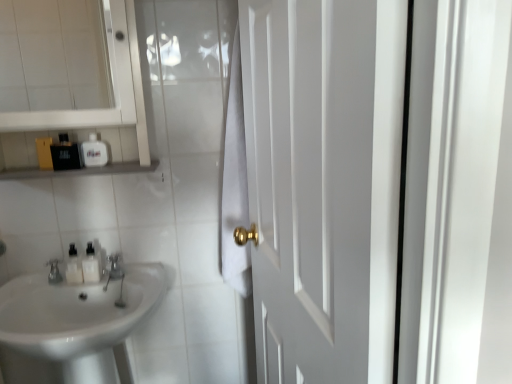
Locate an element on the screen. Image resolution: width=512 pixels, height=384 pixels. blank space situated above black plastic container at upper left (from a real-world perspective) is located at coordinates (80, 158).